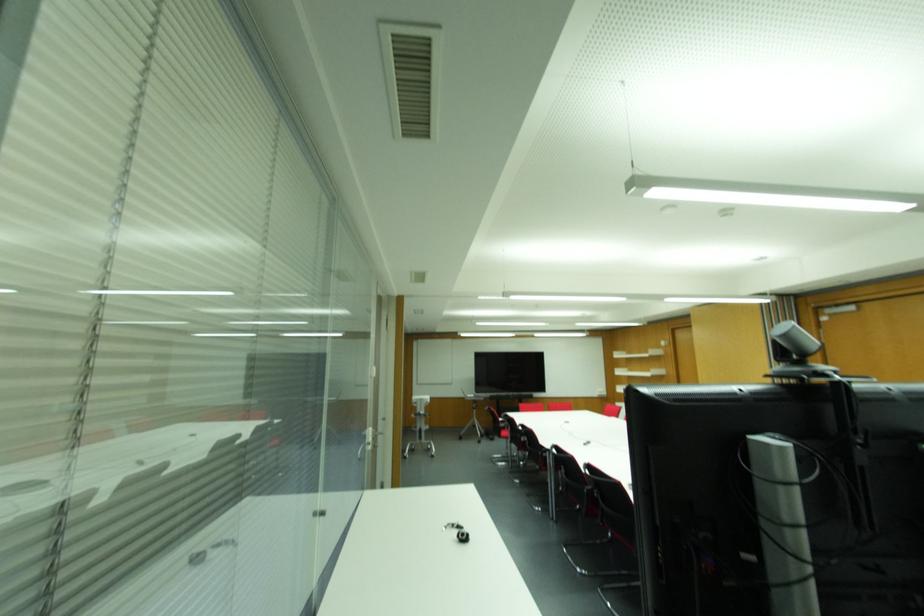
The image size is (924, 616). What are the coordinates of `metal door handle` in the screenshot? It's located at (367, 444).